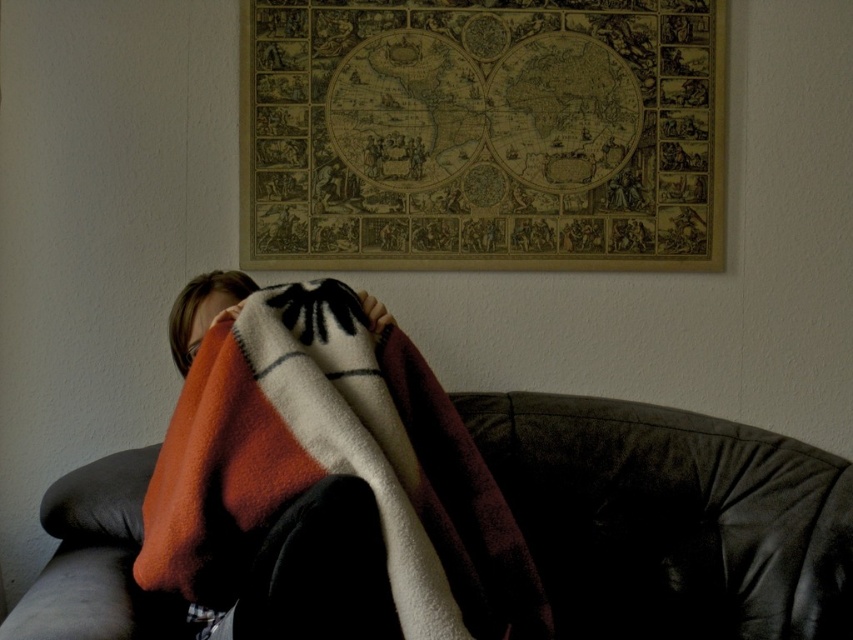
Question: Considering the relative positions of leather couch at center and smooth skin face at center in the image provided, where is leather couch at center located with respect to smooth skin face at center?

Choices:
 (A) above
 (B) below

Answer: (B)

Question: Which point is closer to the camera?

Choices:
 (A) multicolored fleece blanket at center
 (B) leather couch at center

Answer: (A)

Question: Observing the image, what is the correct spatial positioning of leather couch at center in reference to multicolored fleece blanket at center?

Choices:
 (A) left
 (B) right

Answer: (B)

Question: Does multicolored fleece blanket at center come in front of smooth skin face at center?

Choices:
 (A) yes
 (B) no

Answer: (A)

Question: Which is nearer to the leather couch at center?

Choices:
 (A) smooth skin face at center
 (B) multicolored fleece blanket at center

Answer: (B)

Question: Which object is farther from the camera taking this photo?

Choices:
 (A) multicolored fleece blanket at center
 (B) leather couch at center
 (C) smooth skin face at center

Answer: (B)